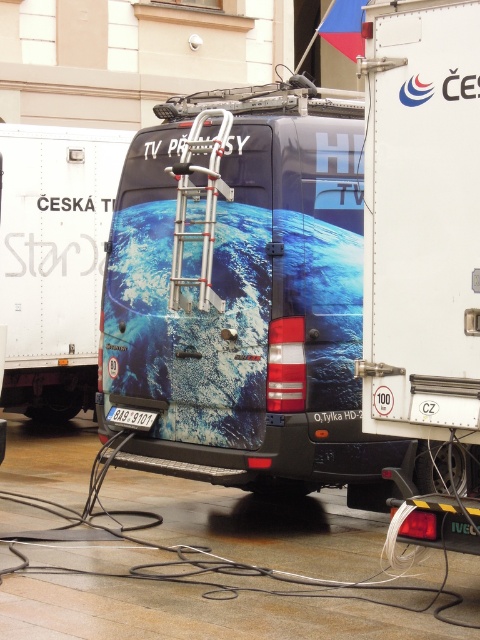
You are a technician needing to reach the roof of the metallic blue van at center to fix an antenna. The ladder you have is the metallic silver ladder at center. Will the ladder be tall enough to reach the roof?

The metallic silver ladder at center is much taller than the metallic blue van at center, so yes, the ladder will be tall enough to reach the roof.